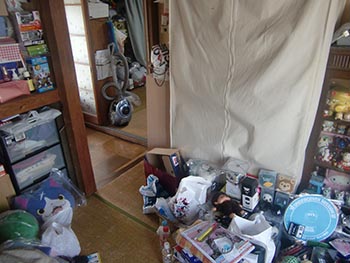
Find the location of a particular element. The width and height of the screenshot is (350, 263). shoebox is located at coordinates (160, 154).